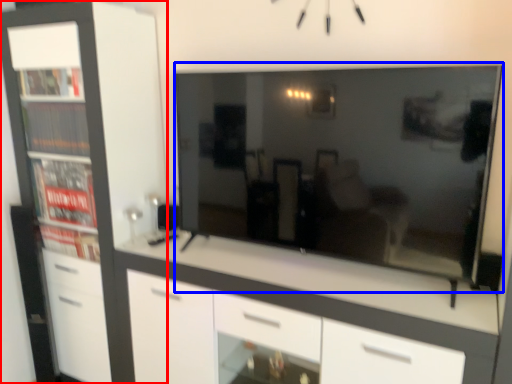
Question: Which of the following is the closest to the observer, cabinetry (highlighted by a red box) or television (highlighted by a blue box)?

Choices:
 (A) cabinetry
 (B) television

Answer: (B)